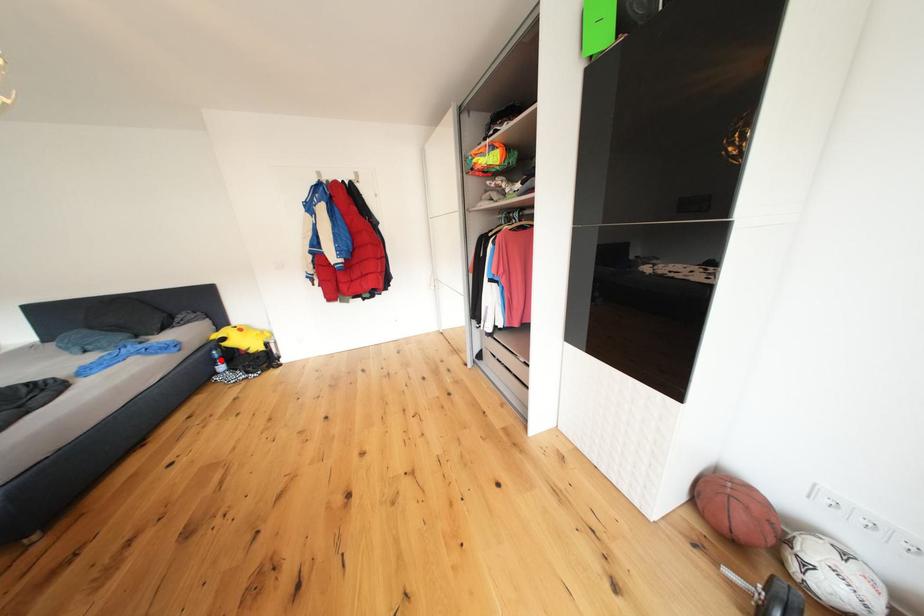
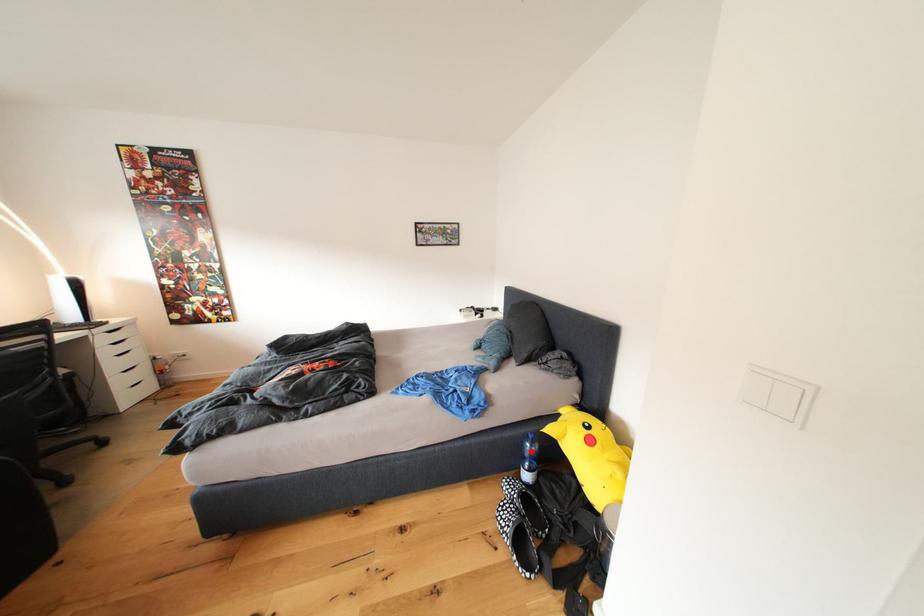
Consider the image. I am providing you with two images of the same scene from different viewpoints. A red point is marked on the first image and another point is marked on the second image. Are the points marked in image1 and image2 representing the same 3D position?

Yes